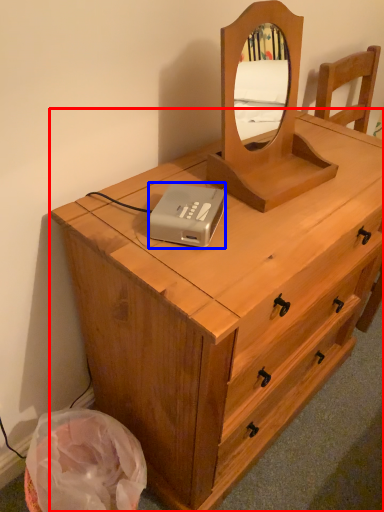
Question: Which of the following is the closest to the observer, chest of drawers (highlighted by a red box) or cassette (highlighted by a blue box)?

Choices:
 (A) chest of drawers
 (B) cassette

Answer: (A)